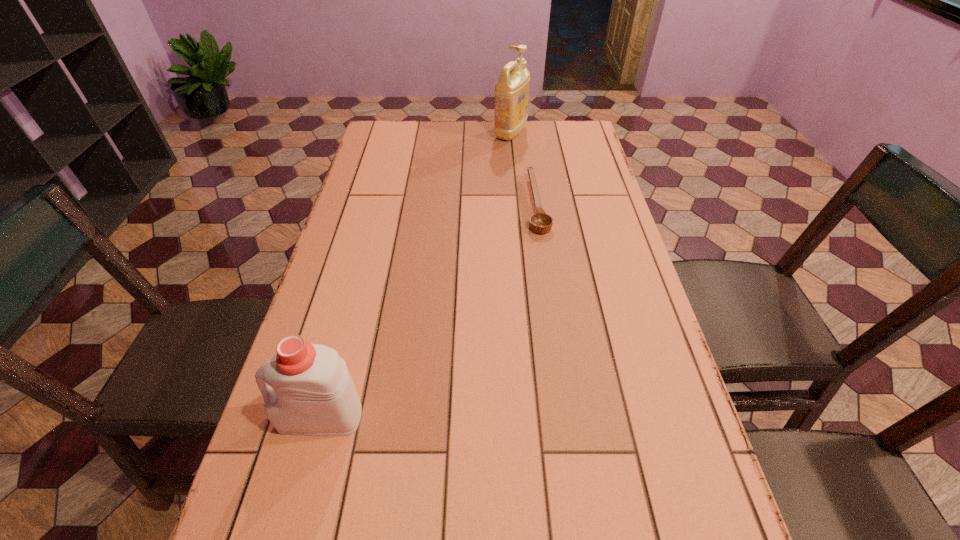
Locate which object ranks in proximity to the second nearest object. Please provide its 2D coordinates. Your answer should be formatted as a tuple, i.e. [(x, y)], where the tuple contains the x and y coordinates of a point satisfying the conditions above.

[(511, 91)]